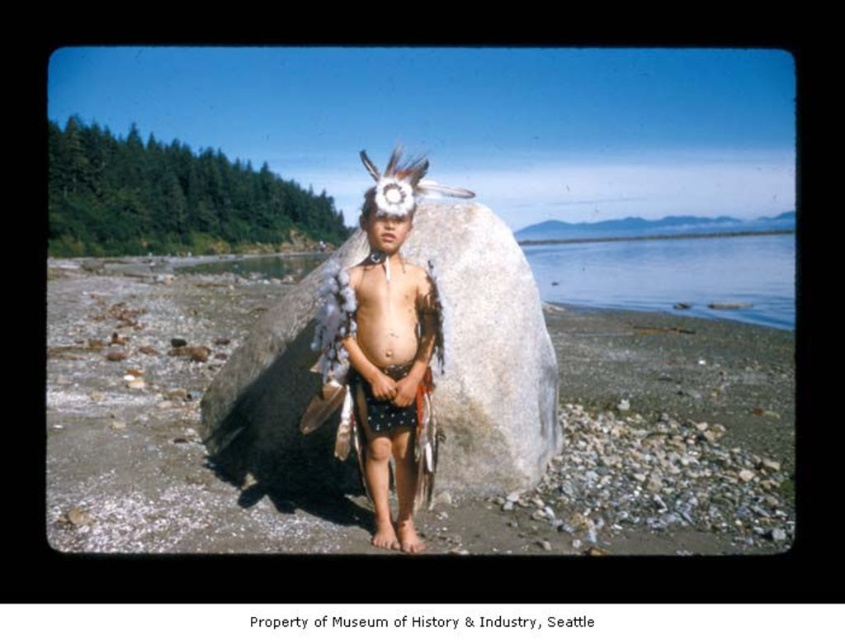
Does gray/rough rock at center appear on the right side of white feather headdress at center?

Indeed, gray/rough rock at center is positioned on the right side of white feather headdress at center.

Who is positioned more to the left, gray/rough rock at center or white feather headdress at center?

Positioned to the left is white feather headdress at center.

Is point (544, 392) more distant than point (412, 307)?

Yes, point (544, 392) is behind point (412, 307).

I want to click on gray/rough rock at center, so click(x=486, y=353).

Does point (440, 291) come behind point (615, 257)?

No, (440, 291) is closer to viewer.

Can you confirm if gray/rough rock at center is smaller than clear water at center?

Yes, gray/rough rock at center is smaller than clear water at center.

I want to click on gray/rough rock at center, so click(486, 353).

Between smooth sand at center and gray/rough rock at center, which one has less height?

gray/rough rock at center is shorter.

How far apart are smooth sand at center and gray/rough rock at center?

smooth sand at center is 9.63 meters from gray/rough rock at center.

The image size is (845, 640). I want to click on smooth sand at center, so click(x=653, y=442).